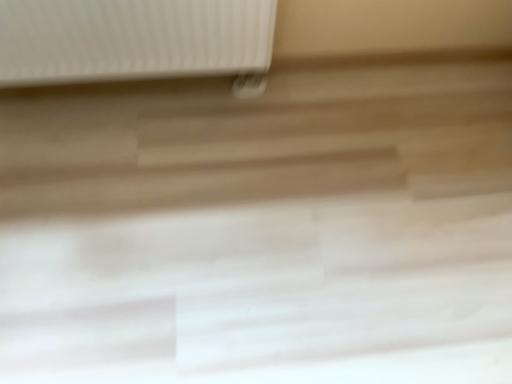
Locate an element on the screen. vacant region below white ribbed radiator at upper left (from a real-world perspective) is located at coordinates (129, 81).